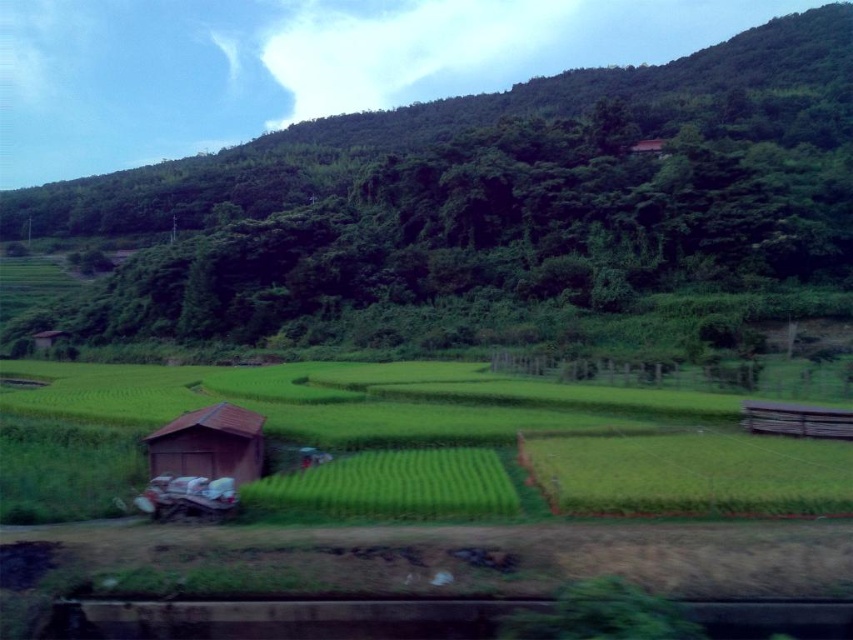
Does point (663, 452) lie behind point (235, 474)?

Yes.

Is point (469, 410) positioned in front of point (247, 472)?

No.

This screenshot has height=640, width=853. What are the coordinates of `green grassy field at center` in the screenshot? It's located at (483, 428).

Measure the distance from green leafy forest at upper center to brown wooden hut at lower left.

A distance of 144.57 meters exists between green leafy forest at upper center and brown wooden hut at lower left.

Is point (735, 198) farther from viewer compared to point (152, 442)?

Yes, point (735, 198) is behind point (152, 442).

Identify the location of green leafy forest at upper center. (482, 193).

Between point (202, 259) and point (70, 385), which one is positioned in front?

Point (70, 385)

Is point (428, 285) farther from viewer compared to point (741, 490)?

Yes, it is behind point (741, 490).

This screenshot has height=640, width=853. I want to click on green leafy forest at upper center, so tap(482, 193).